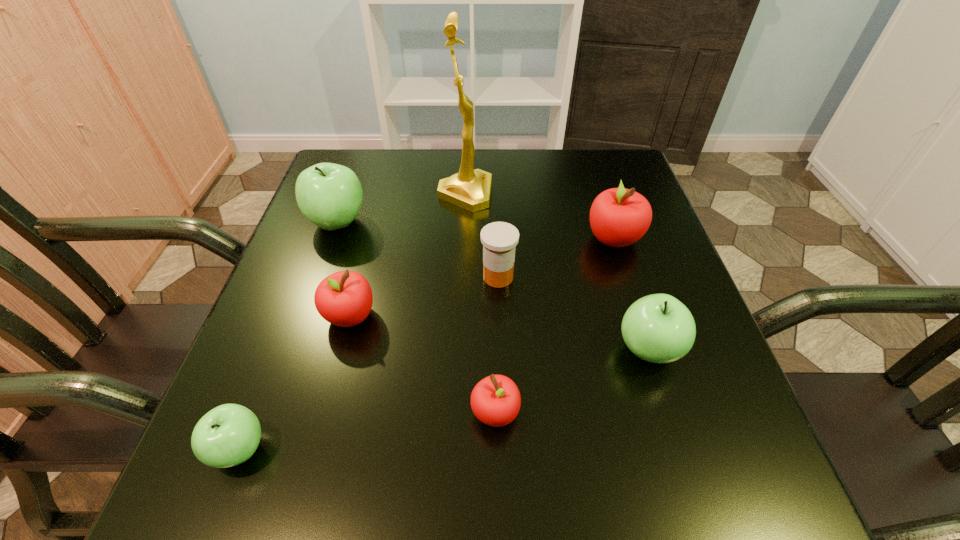
The image size is (960, 540). In the image, there is a desktop. What are the coordinates of `vacant space at the right edge` in the screenshot? It's located at (599, 267).

At what (x,y) coordinates should I click in order to perform the action: click on free location at the far left corner of the desktop. Please return your answer as a coordinate pair (x, y). The height and width of the screenshot is (540, 960). Looking at the image, I should click on (377, 153).

Where is `vacant space at the near right corner of the desktop`? Image resolution: width=960 pixels, height=540 pixels. vacant space at the near right corner of the desktop is located at coordinates (771, 488).

The width and height of the screenshot is (960, 540). In order to click on empty location between the biggest green apple and the fifth nearest object in this screenshot , I will do `click(418, 249)`.

Find the location of a particular element. empty location between the second smallest red apple and the biggest green apple is located at coordinates (344, 269).

In order to click on vacant space that's between the nearest red apple and the award in this screenshot , I will do `click(480, 303)`.

The image size is (960, 540). In order to click on unoccupied position between the second nearest green apple and the leftmost red apple in this screenshot , I will do `click(499, 333)`.

Identify the location of vacant area between the golden award and the second smallest red apple. (408, 255).

Where is `free space between the golden award and the smallest red apple`? The height and width of the screenshot is (540, 960). free space between the golden award and the smallest red apple is located at coordinates (480, 303).

At what (x,y) coordinates should I click in order to perform the action: click on free space between the second smallest red apple and the rightmost red apple. Please return your answer as a coordinate pair (x, y). This screenshot has width=960, height=540. Looking at the image, I should click on (482, 277).